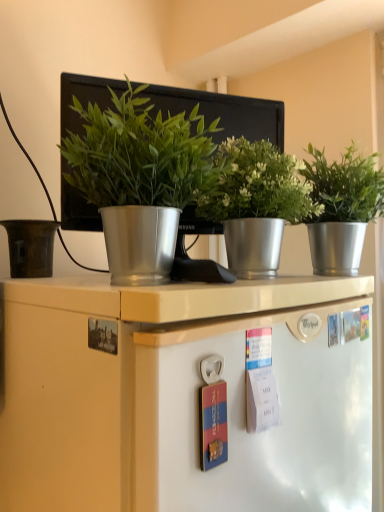
Question: Should I look upward or downward to see silver metallic pot at right, which is counted as the 1th houseplant, starting from the right?

Choices:
 (A) down
 (B) up

Answer: (B)

Question: From a real-world perspective, is metallic silver pot at center, the 2th houseplant viewed from the left, below matte brown pot at left?

Choices:
 (A) yes
 (B) no

Answer: (B)

Question: Does metallic silver pot at center, which is counted as the second houseplant, starting from the right, have a lesser width compared to matte brown pot at left?

Choices:
 (A) no
 (B) yes

Answer: (A)

Question: Is metallic silver pot at center, which is counted as the second houseplant, starting from the right, with matte brown pot at left?

Choices:
 (A) no
 (B) yes

Answer: (A)

Question: Considering the relative sizes of metallic silver pot at center, the 2th houseplant viewed from the left, and matte brown pot at left in the image provided, is metallic silver pot at center, the 2th houseplant viewed from the left, taller than matte brown pot at left?

Choices:
 (A) yes
 (B) no

Answer: (A)

Question: Is the position of metallic silver pot at center, which is counted as the second houseplant, starting from the right, less distant than that of matte brown pot at left?

Choices:
 (A) no
 (B) yes

Answer: (B)

Question: Is matte brown pot at left touching metallic silver pot at center, which is counted as the second houseplant, starting from the right?

Choices:
 (A) no
 (B) yes

Answer: (A)

Question: Is matte brown pot at left shorter than metallic silver pot at center, which is counted as the second houseplant, starting from the right?

Choices:
 (A) yes
 (B) no

Answer: (A)

Question: Can you confirm if matte brown pot at left is positioned to the left of metallic silver pot at center, the 2th houseplant viewed from the left?

Choices:
 (A) no
 (B) yes

Answer: (B)

Question: From the image's perspective, does matte brown pot at left appear higher than metallic silver pot at center, the 2th houseplant viewed from the left?

Choices:
 (A) no
 (B) yes

Answer: (A)

Question: Considering the relative sizes of matte brown pot at left and metallic silver pot at center, the 2th houseplant viewed from the left, in the image provided, is matte brown pot at left thinner than metallic silver pot at center, the 2th houseplant viewed from the left,?

Choices:
 (A) yes
 (B) no

Answer: (A)

Question: Does matte brown pot at left have a smaller size compared to metallic silver pot at center, the 2th houseplant viewed from the left?

Choices:
 (A) yes
 (B) no

Answer: (A)

Question: From a real-world perspective, does green metallic plant pot at center, the first houseplant positioned from the left, sit lower than metallic silver pot at center, the 2th houseplant viewed from the left?

Choices:
 (A) no
 (B) yes

Answer: (A)